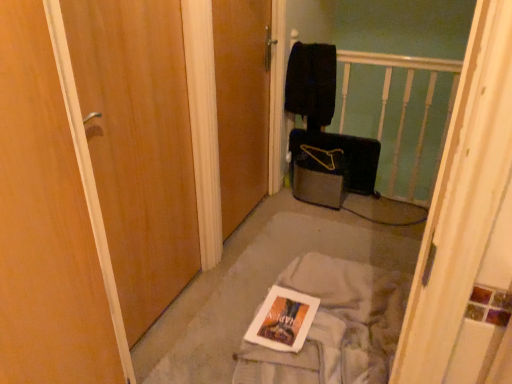
Question: From the image's perspective, relative to white glossy magazine at center, is white fabric at center above or below?

Choices:
 (A) below
 (B) above

Answer: (B)

Question: From a real-world perspective, is white fabric at center positioned above or below white glossy magazine at center?

Choices:
 (A) below
 (B) above

Answer: (A)

Question: Estimate the real-world distances between objects in this image. Which object is farther from the white wooden balustrade at upper center?

Choices:
 (A) white fabric at center
 (B) black fabric suitcase at center
 (C) white glossy magazine at center
 (D) wooden door at center, which is the 1th door from right to left
 (E) white fabric at center

Answer: (C)

Question: Which is farther from the wooden door at center, placed as the 2th door when sorted from left to right?

Choices:
 (A) white glossy magazine at center
 (B) white fabric at center
 (C) wooden door at left, which is the first door in left-to-right order
 (D) black fabric suitcase at center
 (E) white wooden balustrade at upper center

Answer: (A)